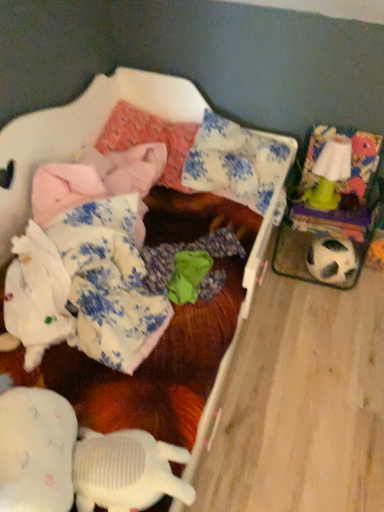
You are a GUI agent. You are given a task and a screenshot of the screen. Output one action in this format:
    pyautogui.click(x=<x>, y=<y>)
    Task: Click on the free space in front of black and white textured football at right
    This screenshot has height=512, width=384.
    Given the screenshot: What is the action you would take?
    [x=339, y=309]